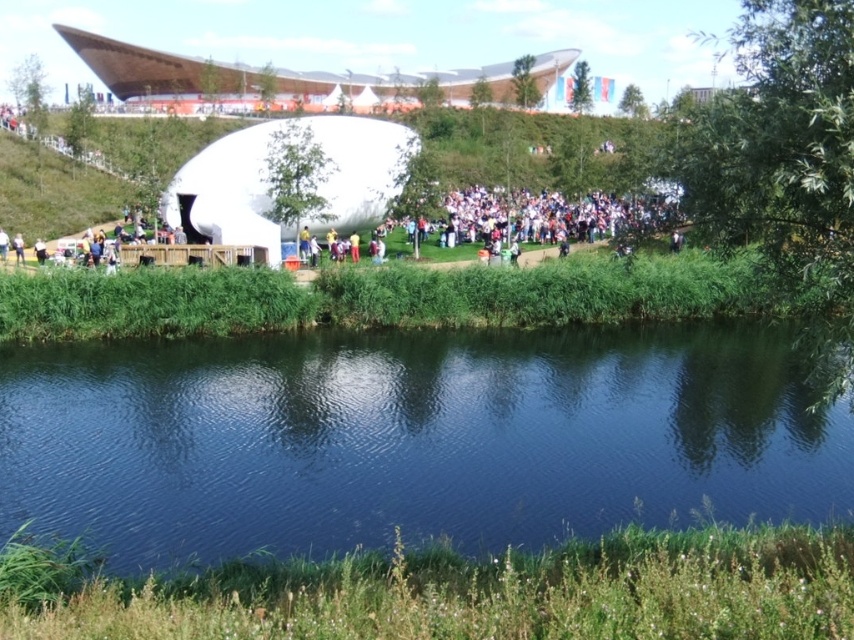
Question: Estimate the real-world distances between objects in this image. Which object is farther from the light brown fabric person at lower left?

Choices:
 (A) dark blue water at center
 (B) blue fabric person at center
 (C) white matte person at center
 (D) yellow fabric person at center

Answer: (A)

Question: Based on their relative distances, which object is nearer to the light brown fabric person at lower left?

Choices:
 (A) white matte person at center
 (B) blue fabric person at center

Answer: (A)

Question: Is yellow fabric person at center above white matte person at center?

Choices:
 (A) no
 (B) yes

Answer: (B)

Question: Which object is farther from the camera taking this photo?

Choices:
 (A) blue fabric person at center
 (B) light brown fabric person at lower left
 (C) yellow fabric person at center
 (D) white matte person at center

Answer: (C)

Question: Does dark blue water at center have a greater width compared to white matte person at center?

Choices:
 (A) no
 (B) yes

Answer: (B)

Question: From the image, what is the correct spatial relationship of dark blue water at center in relation to light brown fabric person at lower left?

Choices:
 (A) above
 (B) below

Answer: (B)